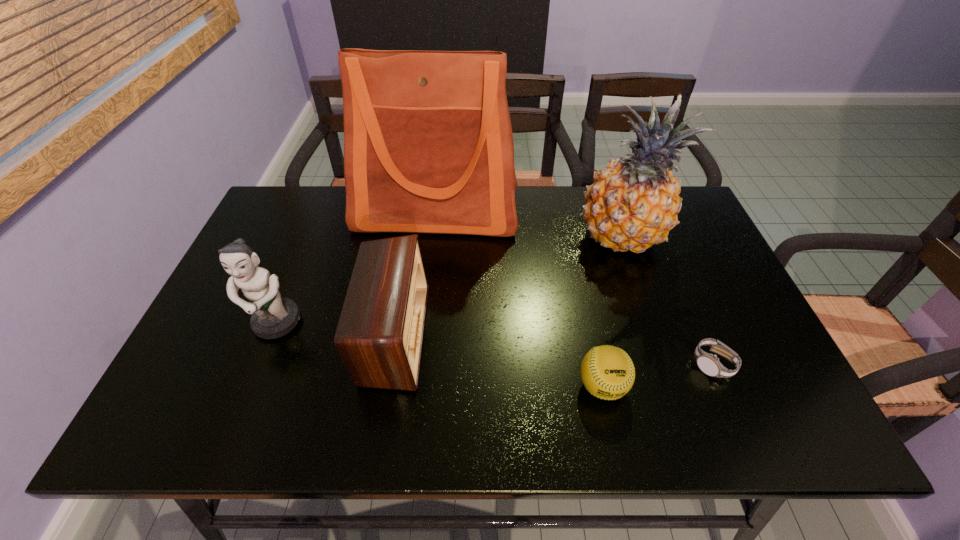
Identify the location of empty space that is in between the shopping bag and the softball. (519, 299).

I want to click on free space between the pineapple and the fourth shortest object, so click(x=448, y=281).

Where is `free space that is in between the watch and the softball`? free space that is in between the watch and the softball is located at coordinates (658, 375).

This screenshot has width=960, height=540. What are the coordinates of `vacant space that is in between the pineapple and the shopping bag` in the screenshot? It's located at (528, 226).

Identify the location of vacant region between the shortest object and the pineapple. The width and height of the screenshot is (960, 540). (666, 301).

The image size is (960, 540). I want to click on free space between the watch and the fifth tallest object, so click(658, 375).

Locate an element on the screen. This screenshot has width=960, height=540. object that is the fifth nearest to the shopping bag is located at coordinates (709, 364).

At what (x,y) coordinates should I click in order to perform the action: click on object that is the fifth nearest to the softball. Please return your answer as a coordinate pair (x, y). Image resolution: width=960 pixels, height=540 pixels. Looking at the image, I should click on (272, 317).